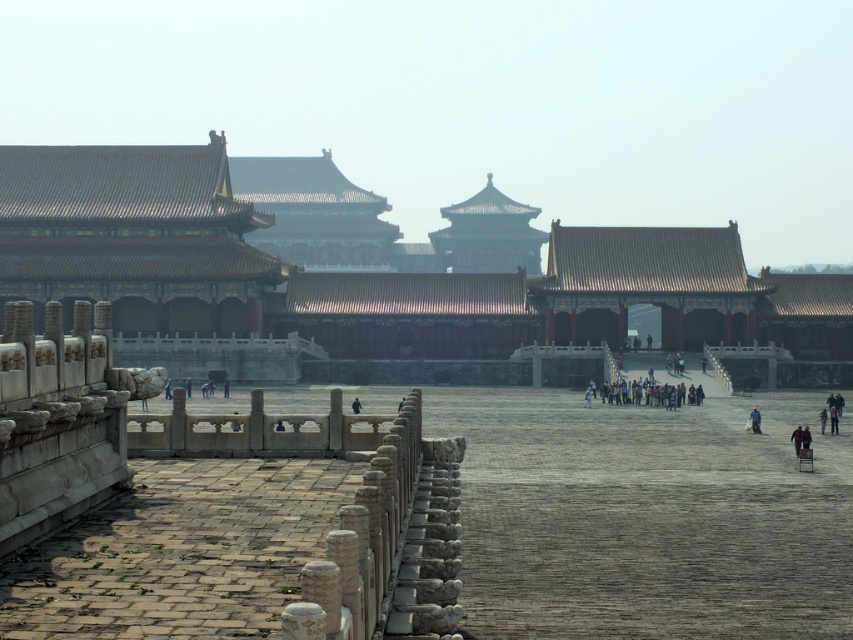
Question: From the image, what is the correct spatial relationship of shiny gold roof at center in relation to dark gray stone people at center?

Choices:
 (A) above
 (B) below

Answer: (A)

Question: Which point appears closest to the camera in this image?

Choices:
 (A) (759, 419)
 (B) (90, 246)
 (C) (668, 404)
 (D) (798, 448)

Answer: (D)

Question: Which of the following is the closest to the observer?

Choices:
 (A) (796, 452)
 (B) (695, 403)
 (C) (752, 416)

Answer: (A)

Question: Is shiny gold roof at center positioned behind dark gray stone people at center?

Choices:
 (A) no
 (B) yes

Answer: (A)

Question: Estimate the real-world distances between objects in this image. Which object is closer to the dark brown leather jacket at lower right?

Choices:
 (A) dark gray stone people at center
 (B) yellow fabric person at center

Answer: (B)

Question: Does dark gray stone people at center lie behind yellow fabric person at center?

Choices:
 (A) yes
 (B) no

Answer: (A)